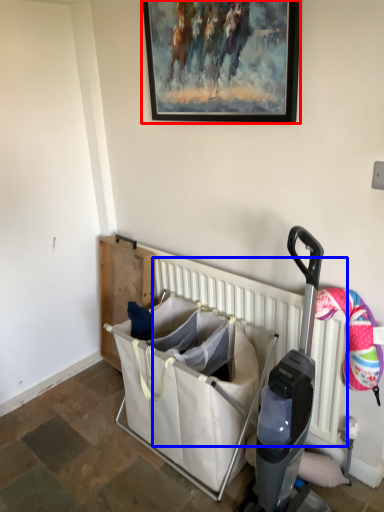
Question: Which object is further to the camera taking this photo, picture frame (highlighted by a red box) or radiator (highlighted by a blue box)?

Choices:
 (A) picture frame
 (B) radiator

Answer: (B)